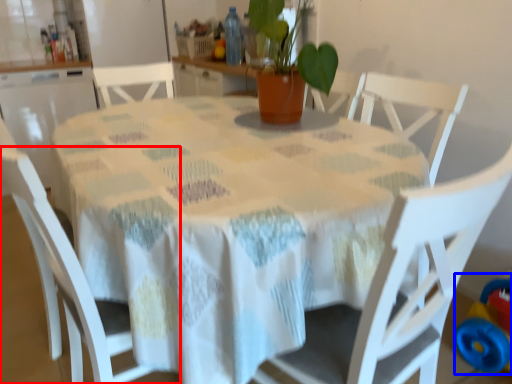
Question: Among these objects, which one is nearest to the camera, chair (highlighted by a red box) or toy (highlighted by a blue box)?

Choices:
 (A) chair
 (B) toy

Answer: (A)